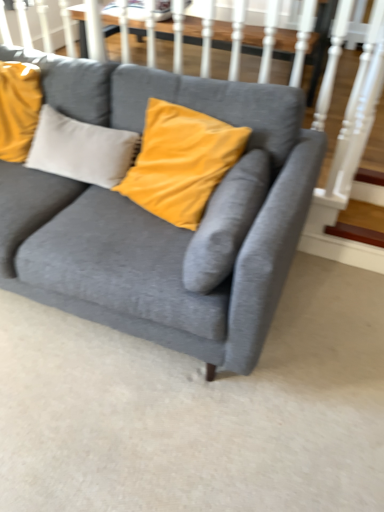
Looking at this image, in order to face wooden stairs at lower right, should I rotate leftwards or rightwards?

You should look right and rotate roughly 21.205 degrees.

Find the location of `wooden stairs at lower right`. wooden stairs at lower right is located at coordinates [356, 234].

This screenshot has width=384, height=512. What do you see at coordinates (356, 234) in the screenshot?
I see `wooden stairs at lower right` at bounding box center [356, 234].

Image resolution: width=384 pixels, height=512 pixels. Describe the element at coordinates (156, 217) in the screenshot. I see `velvet gray couch at center` at that location.

This screenshot has width=384, height=512. Find the location of `velvet gray couch at center`. velvet gray couch at center is located at coordinates coord(156,217).

Looking at this image, measure the distance between velvet gray couch at center and camera.

The depth of velvet gray couch at center is 1.12 meters.

At what (x,y) coordinates should I click in order to perform the action: click on wooden stairs at lower right. Please return your answer as a coordinate pair (x, y). Looking at the image, I should click on (356, 234).

Is wooden stairs at lower right at the right side of velvet gray couch at center?

Correct, you'll find wooden stairs at lower right to the right of velvet gray couch at center.

Consider the image. Does wooden stairs at lower right come in front of velvet gray couch at center?

No, wooden stairs at lower right is further to the viewer.

Considering the positions of points (362, 234) and (244, 102), is point (362, 234) closer to camera compared to point (244, 102)?

No, it is behind (244, 102).

From the image's perspective, would you say wooden stairs at lower right is positioned over velvet gray couch at center?

No, from the image's perspective, wooden stairs at lower right is not on top of velvet gray couch at center.

From a real-world perspective, does wooden stairs at lower right sit lower than velvet gray couch at center?

Yes, from a real-world perspective, wooden stairs at lower right is beneath velvet gray couch at center.

Does wooden stairs at lower right have a greater width compared to velvet gray couch at center?

No, wooden stairs at lower right is not wider than velvet gray couch at center.

Is wooden stairs at lower right taller than velvet gray couch at center?

In fact, wooden stairs at lower right may be shorter than velvet gray couch at center.

Which of these two, wooden stairs at lower right or velvet gray couch at center, is bigger?

velvet gray couch at center.

Based on the photo, is wooden stairs at lower right inside the boundaries of velvet gray couch at center, or outside?

wooden stairs at lower right is not enclosed by velvet gray couch at center.

Is wooden stairs at lower right positioned far away from velvet gray couch at center?

Yes, wooden stairs at lower right is far from velvet gray couch at center.

Looking at this image, is velvet gray couch at center at the back of wooden stairs at lower right?

wooden stairs at lower right does not have its back to velvet gray couch at center.

Locate an element on the screen. This screenshot has height=512, width=384. stairs that appears on the right of velvet gray couch at center is located at coordinates (x=356, y=234).

In the scene shown: In the image, is velvet gray couch at center on the left side or the right side of wooden stairs at lower right?

Clearly, velvet gray couch at center is on the left of wooden stairs at lower right in the image.

Considering the positions of objects velvet gray couch at center and wooden stairs at lower right in the image provided, who is behind, velvet gray couch at center or wooden stairs at lower right?

Positioned behind is wooden stairs at lower right.

Which is farther, (127, 269) or (369, 239)?

The point (369, 239) is farther from the camera.

From the image's perspective, is velvet gray couch at center located above or below wooden stairs at lower right?

velvet gray couch at center is above wooden stairs at lower right.

In the scene shown: From a real-world perspective, which object stands above the other?

velvet gray couch at center is physically above.

Between velvet gray couch at center and wooden stairs at lower right, which one has larger width?

velvet gray couch at center.

Does velvet gray couch at center have a lesser height compared to wooden stairs at lower right?

No, velvet gray couch at center is not shorter than wooden stairs at lower right.

In the scene shown: Which of these two, velvet gray couch at center or wooden stairs at lower right, is smaller?

wooden stairs at lower right.

Is velvet gray couch at center outside of wooden stairs at lower right?

velvet gray couch at center lies outside wooden stairs at lower right's area.

Is velvet gray couch at center not close to wooden stairs at lower right?

Indeed, velvet gray couch at center is not near wooden stairs at lower right.

Is velvet gray couch at center positioned with its back to wooden stairs at lower right?

velvet gray couch at center does not have its back to wooden stairs at lower right.

How many degrees apart are the facing directions of velvet gray couch at center and wooden stairs at lower right?

They differ by 0.398 degrees in their facing directions.

How distant is velvet gray couch at center from wooden stairs at lower right?

3.37 feet.

Locate an element on the screen. This screenshot has width=384, height=512. stairs below the velvet gray couch at center (from the image's perspective) is located at coordinates (356, 234).

Locate an element on the screen. studio couch on the left of wooden stairs at lower right is located at coordinates (156, 217).

Locate an element on the screen. studio couch located above the wooden stairs at lower right (from the image's perspective) is located at coordinates (156, 217).